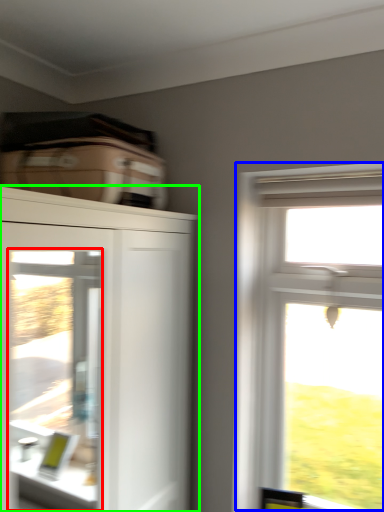
Question: Which object is the closest to the screen door (highlighted by a red box)? Choose among these: window (highlighted by a blue box) or cupboard (highlighted by a green box).

Choices:
 (A) window
 (B) cupboard

Answer: (B)